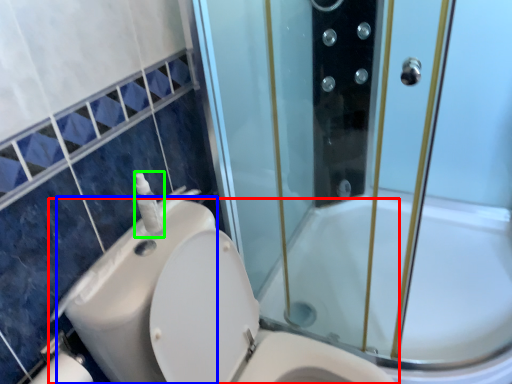
Question: Which is farther away from toilet (highlighted by a red box)? sink (highlighted by a blue box) or soap dispenser (highlighted by a green box)?

Choices:
 (A) sink
 (B) soap dispenser

Answer: (B)